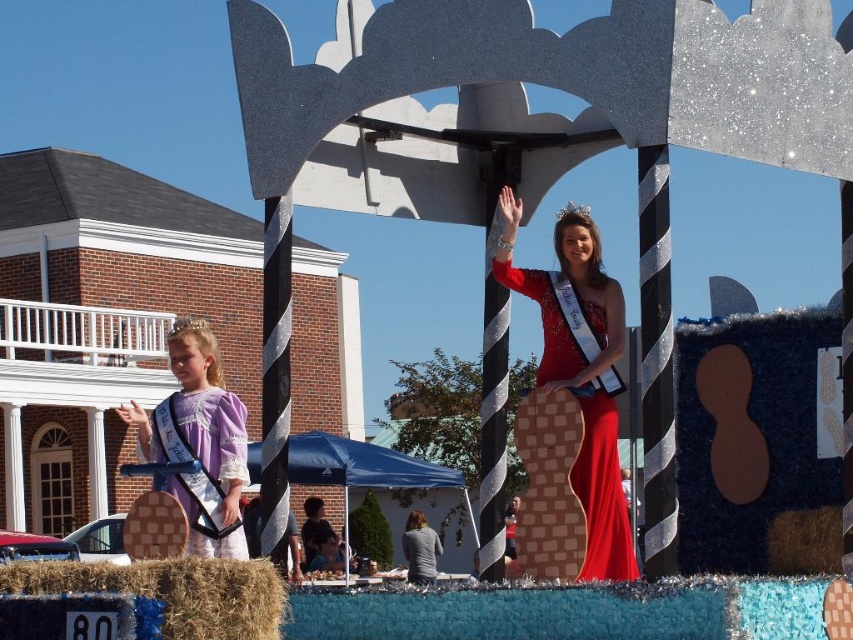
You are organizing a photo shoot and need to ensure that the purple satin sash at center and the brown straw bale at lower left are visible in the frame. Based on their sizes, which object should you prioritize placing closer to the camera to avoid being overshadowed?

The brown straw bale at lower left should be placed closer to the camera since its width is smaller than the purple satin sash at center, ensuring it remains visible in the photo.

What is the location of the point marked at coordinates (583,432) in the image?

The point marked at coordinates (583,432) is located on the shiny red dress at center.

Consider the image. You are a photographer trying to capture the float from the front. You notice two points marked on the float at coordinates point (213, 403) and point (621, 561). Which point is closer to your camera lens?

Point (213, 403) is closer to the camera lens because it is further to the viewer than point (621, 561).